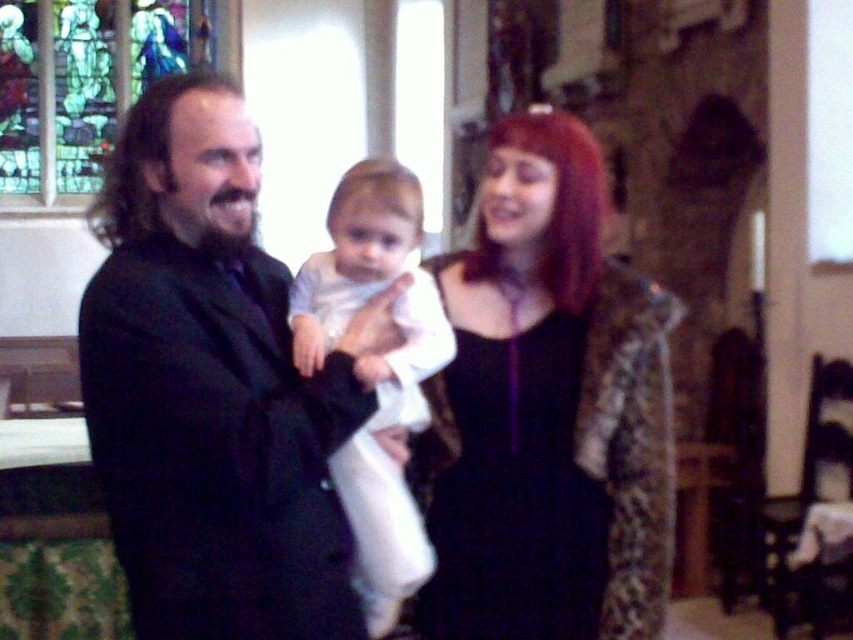
Question: Is white clothed baby at center to the left of stained glass window at upper left from the viewer's perspective?

Choices:
 (A) no
 (B) yes

Answer: (A)

Question: Which is nearer to the shiny black dress at center?

Choices:
 (A) white clothed baby at center
 (B) black matte suit at center
 (C) stained glass window at upper left

Answer: (A)

Question: Which of the following is the farthest from the observer?

Choices:
 (A) (305, 332)
 (B) (225, 445)
 (C) (546, 154)

Answer: (C)

Question: From the image, what is the correct spatial relationship of shiny black dress at center in relation to white clothed baby at center?

Choices:
 (A) below
 (B) above

Answer: (B)

Question: Is shiny black dress at center to the right of white clothed baby at center from the viewer's perspective?

Choices:
 (A) yes
 (B) no

Answer: (A)

Question: Which is farther from the shiny black dress at center?

Choices:
 (A) black matte suit at center
 (B) stained glass window at upper left

Answer: (B)